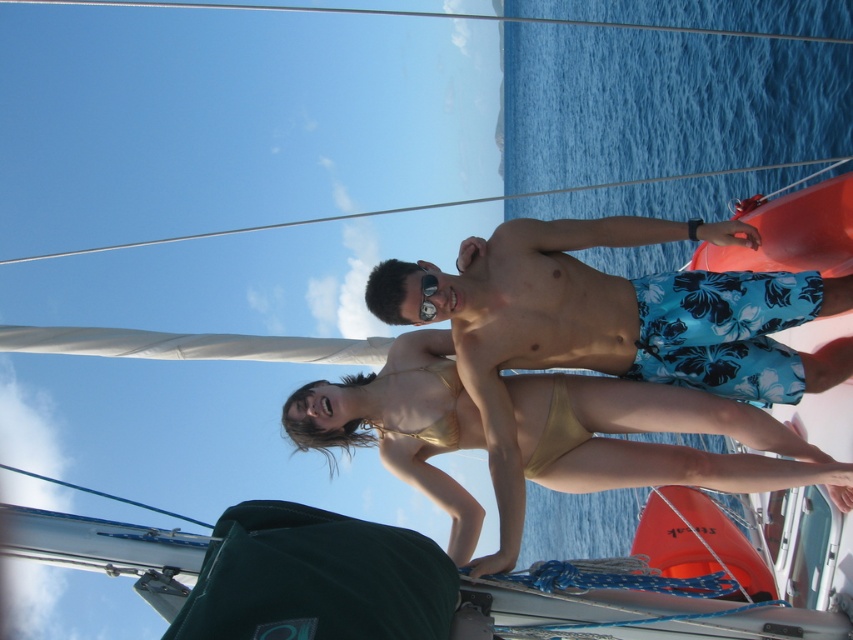
You are standing on the deck of the sailboat and want to move from the point at coordinates point (772, 266) to the point at coordinates point (421, 317). Which direction should you move in relation to the two people standing on the deck?

You should move downward and to the right because point (772, 266) is behind point (421, 317), which is closer to the front of the boat.

You are a photographer on the boat and want to take a picture of the blue floral swim trunks at center and the matte black goggles at center. Which object is positioned lower in the frame?

The blue floral swim trunks at center is located below matte black goggles at center, so the blue floral swim trunks at center is positioned lower in the frame.